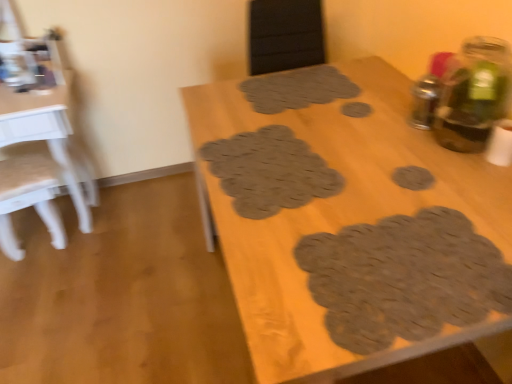
Identify the location of free area in between metallic silver bottle at upper right, which is counted as the first bottle, starting from the back, and brown textured mat at bottom right, which is the fifth footprint from back to front. (411, 181).